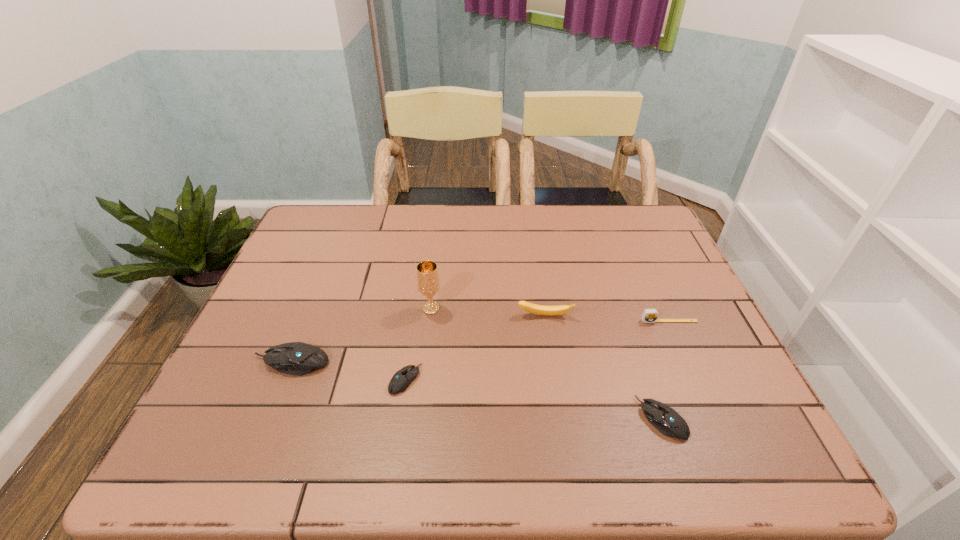
At what (x,y) coordinates should I click in order to perform the action: click on the third tallest object. Please return your answer as a coordinate pair (x, y). Looking at the image, I should click on (296, 358).

At what (x,y) coordinates should I click in order to perform the action: click on the tallest computer mouse. Please return your answer as a coordinate pair (x, y). The image size is (960, 540). Looking at the image, I should click on (296, 358).

Image resolution: width=960 pixels, height=540 pixels. Find the location of `the second computer mouse from left to right`. the second computer mouse from left to right is located at coordinates (400, 381).

The image size is (960, 540). I want to click on the shortest computer mouse, so click(400, 381).

Find the location of a particular element. The height and width of the screenshot is (540, 960). the second shortest object is located at coordinates (665, 419).

This screenshot has width=960, height=540. In order to click on the rightmost computer mouse in this screenshot , I will do `click(665, 419)`.

This screenshot has height=540, width=960. I want to click on chalice, so click(x=427, y=273).

The image size is (960, 540). In order to click on tape measure in this screenshot , I will do `click(649, 315)`.

Locate an element on the screen. The height and width of the screenshot is (540, 960). banana is located at coordinates (532, 308).

This screenshot has height=540, width=960. I want to click on the fourth object from left to right, so click(532, 308).